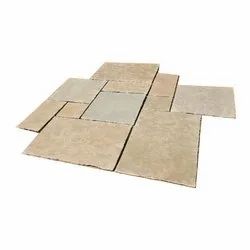
At what (x,y) coordinates should I click in order to perform the action: click on large sized tiles. Please return your answer as a coordinate pair (x, y). The image size is (250, 250). Looking at the image, I should click on (160, 164), (85, 141).